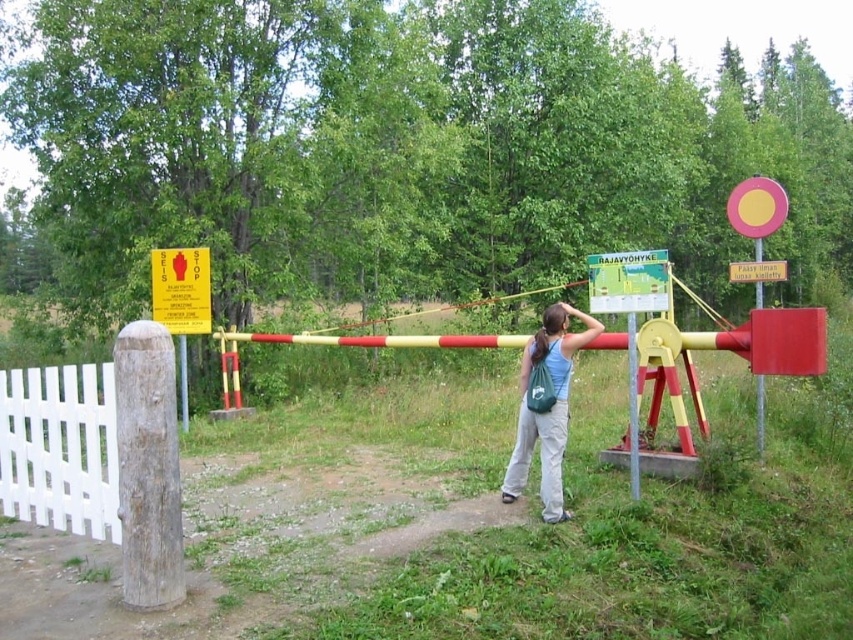
Question: Which of the following is the closest to the observer?

Choices:
 (A) (540, 332)
 (B) (184, 413)
 (C) (550, 461)
 (D) (206, 252)

Answer: (C)

Question: Which point is farther to the camera?

Choices:
 (A) wooden post at left
 (B) yellow paper sign at upper left

Answer: (B)

Question: Which of the following is the closest to the observer?

Choices:
 (A) white wooden fence at left
 (B) blue fabric backpack at center
 (C) yellow paper sign at upper left

Answer: (A)

Question: Is yellow paper sign at upper left above red plastic pole at right?

Choices:
 (A) no
 (B) yes

Answer: (A)

Question: Is red plastic pole at right above wooden post at left?

Choices:
 (A) yes
 (B) no

Answer: (A)

Question: Does red plastic pole at right have a larger size compared to wooden post at left?

Choices:
 (A) no
 (B) yes

Answer: (B)